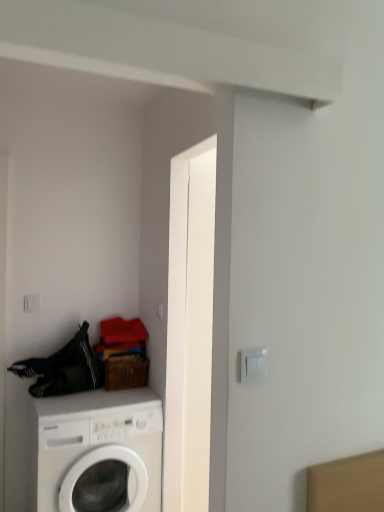
Measure the distance between point (139, 493) and camera.

A distance of 6.79 feet exists between point (139, 493) and camera.

Describe the element at coordinates (99, 451) in the screenshot. I see `white glossy washing machine at lower left` at that location.

What is the approximate height of white glossy washing machine at lower left?

33.58 inches.

Where is `white glossy washing machine at lower left`? white glossy washing machine at lower left is located at coordinates (99, 451).

Identify the location of white glossy washing machine at lower left. The image size is (384, 512). (99, 451).